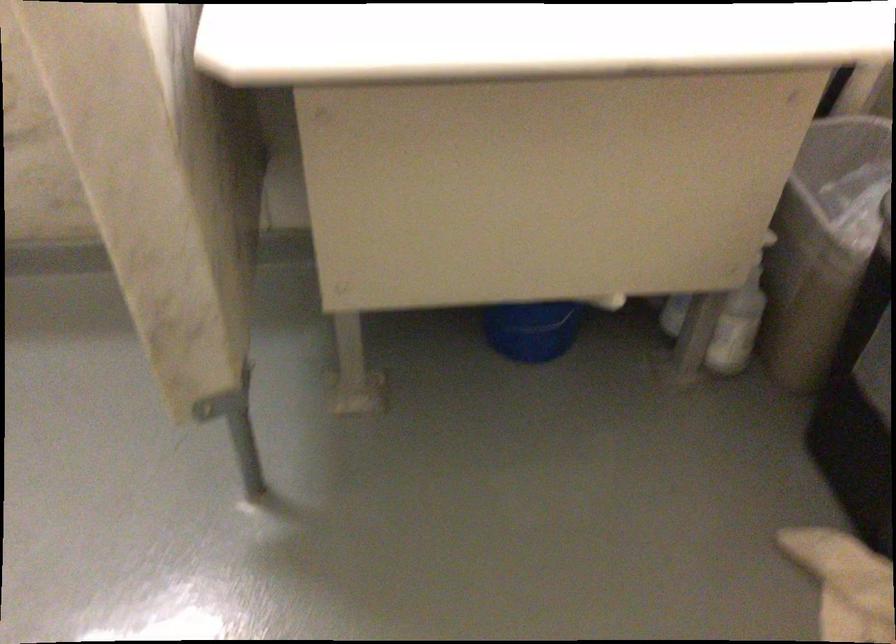
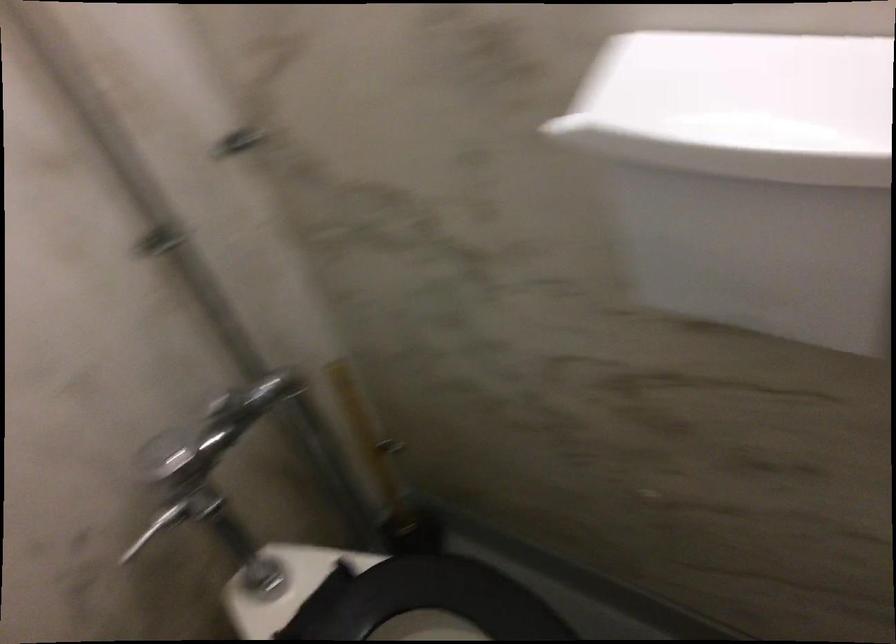
Question: The camera is either moving clockwise (left) or counter-clockwise (right) around the object. The first image is from the beginning of the video and the second image is from the end. Is the camera moving left or right when shooting the video?

Choices:
 (A) Left
 (B) Right

Answer: (B)